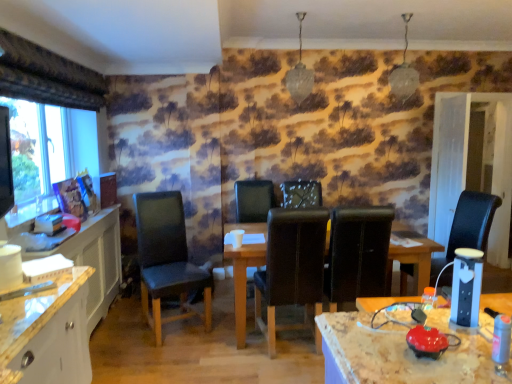
The width and height of the screenshot is (512, 384). What do you see at coordinates (468, 227) in the screenshot?
I see `black leather chair at right, which is counted as the 1th chair, starting from the right` at bounding box center [468, 227].

What is the approximate width of leather at center, arranged as the 2th chair when viewed from the left?

64.04 centimeters.

Locate an element on the screen. The height and width of the screenshot is (384, 512). dark blue leather chair at center, which ranks as the 1th chair in left-to-right order is located at coordinates (167, 260).

You are a GUI agent. You are given a task and a screenshot of the screen. Output one action in this format:
    pyautogui.click(x=<x>, y=<y>)
    Task: Click on the white wood computer desk at left
    This screenshot has height=384, width=512.
    Given the screenshot: What is the action you would take?
    pyautogui.click(x=95, y=260)

Measure the distance between point [386,282] and camera.

A distance of 9.98 feet exists between point [386,282] and camera.

Find the location of a particular element. The height and width of the screenshot is (384, 512). wooden table at center is located at coordinates click(243, 281).

You are a GUI agent. You are given a task and a screenshot of the screen. Output one action in this format:
    pyautogui.click(x=<x>, y=<y>)
    Task: Click on the black leather chair at right, which is counted as the 1th chair, starting from the right
    The height and width of the screenshot is (384, 512).
    Given the screenshot: What is the action you would take?
    pyautogui.click(x=468, y=227)

Which of these two, leather at center, arranged as the 2th chair when viewed from the left, or black leather chair at right, which is counted as the 1th chair, starting from the right, is wider?

With larger width is leather at center, arranged as the 2th chair when viewed from the left.

Does leather at center, the fourth chair from the right, touch black leather chair at right, the fifth chair when ordered from left to right?

leather at center, the fourth chair from the right, is not next to black leather chair at right, the fifth chair when ordered from left to right, and they're not touching.

Considering the sizes of objects leather at center, the fourth chair from the right, and black leather chair at right, which is counted as the 1th chair, starting from the right, in the image provided, who is bigger, leather at center, the fourth chair from the right, or black leather chair at right, which is counted as the 1th chair, starting from the right,?

leather at center, the fourth chair from the right.

Considering the points (290, 288) and (462, 196), which point is in front, point (290, 288) or point (462, 196)?

The point (290, 288) is closer to the camera.

What's the angular difference between transparent glass window at left and leather-like black chair at center, which is counted as the 2th chair, starting from the right,'s facing directions?

transparent glass window at left and leather-like black chair at center, which is counted as the 2th chair, starting from the right, are facing 91.3 degrees away from each other.

Which is less distant, (42, 156) or (344, 274)?

The point (344, 274) is closer to the camera.

Is transparent glass window at left outside of leather-like black chair at center, which is counted as the 2th chair, starting from the right?

Yes, transparent glass window at left is located beyond the bounds of leather-like black chair at center, which is counted as the 2th chair, starting from the right.

Is the surface of transparent glass window at left in direct contact with leather-like black chair at center, which is counted as the 4th chair, starting from the left?

No, transparent glass window at left is not in contact with leather-like black chair at center, which is counted as the 4th chair, starting from the left.

From the picture: Considering their positions, is leather at center, the fourth chair from the right, located in front of or behind transparent glass window at left?

Clearly, leather at center, the fourth chair from the right, is in front of transparent glass window at left.

Between leather at center, the fourth chair from the right, and transparent glass window at left, which one has less height?

With less height is transparent glass window at left.

Could you tell me if leather at center, arranged as the 2th chair when viewed from the left, is turned towards transparent glass window at left?

No, leather at center, arranged as the 2th chair when viewed from the left, is not oriented towards transparent glass window at left.

Can you confirm if leather at center, arranged as the 2th chair when viewed from the left, is thinner than transparent glass window at left?

In fact, leather at center, arranged as the 2th chair when viewed from the left, might be wider than transparent glass window at left.

Is point (8, 144) closer or farther from the camera than point (156, 295)?

Clearly, point (8, 144) is closer to the camera than point (156, 295).

How many degrees apart are the facing directions of matte black monitor at left and dark blue leather chair at center, which ranks as the 1th chair in left-to-right order?

The angular difference between matte black monitor at left and dark blue leather chair at center, which ranks as the 1th chair in left-to-right order, is 75.9 degrees.

Is matte black monitor at left behind dark blue leather chair at center, which ranks as the 1th chair in left-to-right order?

That is False.

From a real-world perspective, is matte black monitor at left below dark blue leather chair at center, which ranks as the 1th chair in left-to-right order?

Incorrect, from a real-world perspective, matte black monitor at left is higher than dark blue leather chair at center, which ranks as the 1th chair in left-to-right order.

Is white wood computer desk at left positioned before leather at center?

Yes, the depth of white wood computer desk at left is less than that of leather at center.

Is white wood computer desk at left aimed at leather at center?

Yes.

Is white wood computer desk at left inside or outside of leather at center?

white wood computer desk at left is not inside leather at center, it's outside.

Considering the sizes of black leather chair at center, the third chair viewed from the left, and wooden table at center in the image, is black leather chair at center, the third chair viewed from the left, wider or thinner than wooden table at center?

black leather chair at center, the third chair viewed from the left, is thinner than wooden table at center.

From a real-world perspective, who is located higher, black leather chair at center, the third chair viewed from the left, or wooden table at center?

In real-world perspective, black leather chair at center, the third chair viewed from the left, is above.

At what (x,y) coordinates should I click in order to perform the action: click on the 5th chair positioned above the wooden table at center (from the image's perspective). Please return your answer as a coordinate pair (x, y). Looking at the image, I should click on (301, 194).

Which is behind, point (158, 271) or point (388, 254)?

The point (158, 271) is farther from the camera.

Who is bigger, dark blue leather chair at center, which is counted as the 5th chair, starting from the right, or wooden table at center?

wooden table at center.

Would you say dark blue leather chair at center, which is counted as the 5th chair, starting from the right, is outside wooden table at center?

dark blue leather chair at center, which is counted as the 5th chair, starting from the right, is positioned outside wooden table at center.

Looking at this image, which is more to the left, dark blue leather chair at center, which is counted as the 5th chair, starting from the right, or wooden table at center?

dark blue leather chair at center, which is counted as the 5th chair, starting from the right, is more to the left.

I want to click on the 2nd chair positioned above the leather at center, the fourth chair from the right (from a real-world perspective), so click(468, 227).

Identify the location of window screen in front of the leather-like black chair at center, which is counted as the 2th chair, starting from the right. (35, 148).

Estimate the real-world distances between objects in this image. Which object is further from transparent glass window at left, white wood computer desk at left or matte black monitor at left?

The object further to transparent glass window at left is white wood computer desk at left.

When comparing their distances from leather at center, arranged as the 2th chair when viewed from the left, does matte black monitor at left or leather-like black chair at center, which is counted as the 2th chair, starting from the right, seem further?

Based on the image, matte black monitor at left appears to be further to leather at center, arranged as the 2th chair when viewed from the left.

Which object lies further to the anchor point leather at center, the fourth chair from the right, black leather chair at right, which is counted as the 1th chair, starting from the right, or white wood computer desk at left?

white wood computer desk at left.

Looking at the image, which one is located further to leather-like black chair at center, which is counted as the 4th chair, starting from the left, wooden table at center or transparent glass window at left?

transparent glass window at left is further to leather-like black chair at center, which is counted as the 4th chair, starting from the left.

Based on their spatial positions, is leather at center, the fourth chair from the right, or black leather chair at center, the third chair viewed from the left, further from transparent glass window at left?

black leather chair at center, the third chair viewed from the left, lies further to transparent glass window at left than the other object.

When comparing their distances from matte black monitor at left, does wooden table at center or leather at center, the fourth chair from the right, seem further?

leather at center, the fourth chair from the right, is further to matte black monitor at left.

When comparing their distances from leather at center, does white wood computer desk at left or dark blue leather chair at center, which is counted as the 5th chair, starting from the right, seem closer?

Based on the image, dark blue leather chair at center, which is counted as the 5th chair, starting from the right, appears to be nearer to leather at center.

Estimate the real-world distances between objects in this image. Which object is closer to matte black monitor at left, black leather chair at right, the fifth chair when ordered from left to right, or leather at center?

Based on the image, leather at center appears to be nearer to matte black monitor at left.

Image resolution: width=512 pixels, height=384 pixels. Find the location of `armchair located between white wood computer desk at left and leather-like black chair at center, which is counted as the 4th chair, starting from the left, in the left-right direction`. armchair located between white wood computer desk at left and leather-like black chair at center, which is counted as the 4th chair, starting from the left, in the left-right direction is located at coordinates pyautogui.click(x=254, y=200).

Identify the location of table between matte black monitor at left and leather-like black chair at center, which is counted as the 4th chair, starting from the left. The image size is (512, 384). [243, 281].

The image size is (512, 384). Find the location of `computer monitor between white wood computer desk at left and black leather chair at center, the third chair viewed from the left`. computer monitor between white wood computer desk at left and black leather chair at center, the third chair viewed from the left is located at coordinates (5, 164).

Locate an element on the screen. table between dark blue leather chair at center, which is counted as the 5th chair, starting from the right, and leather-like black chair at center, which is counted as the 4th chair, starting from the left, from left to right is located at coordinates (243, 281).